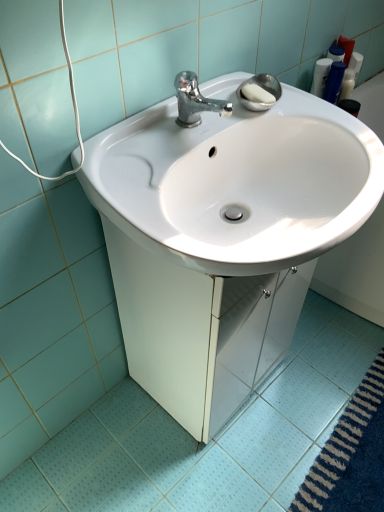
I want to click on free space to the left of chrome metallic faucet at upper center, so click(x=136, y=136).